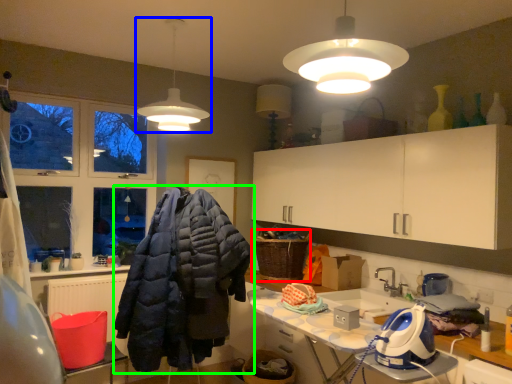
Question: Considering the real-world distances, which object is farthest from laundry basket (highlighted by a red box)? lamp (highlighted by a blue box) or jacket (highlighted by a green box)?

Choices:
 (A) lamp
 (B) jacket

Answer: (A)